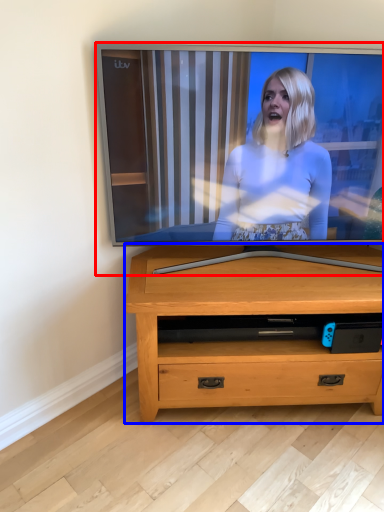
Question: Which of the following is the farthest to the observer, television (highlighted by a red box) or chest of drawers (highlighted by a blue box)?

Choices:
 (A) television
 (B) chest of drawers

Answer: (B)